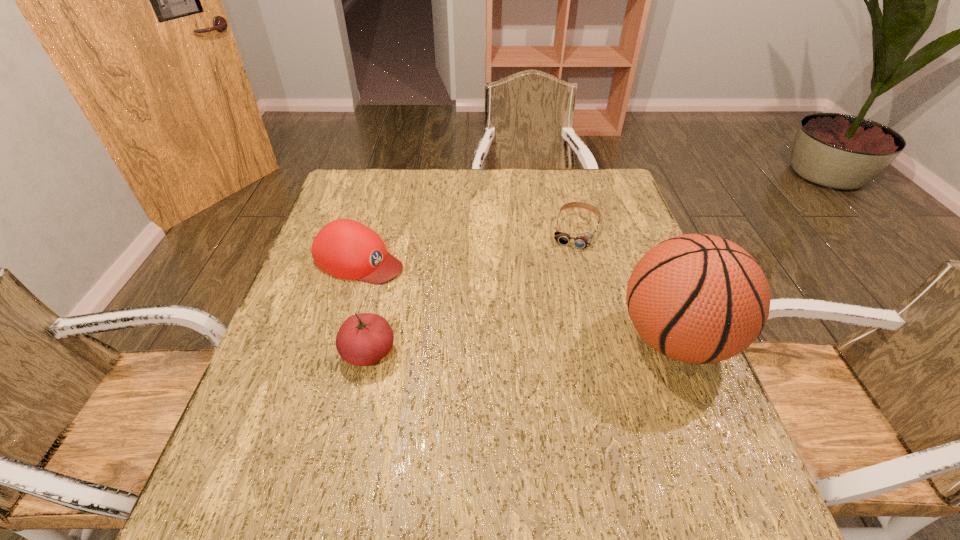
Identify the location of unoccupied area between the baseball cap and the basketball. (517, 299).

You are a GUI agent. You are given a task and a screenshot of the screen. Output one action in this format:
    pyautogui.click(x=<x>, y=<y>)
    Task: Click on the object that is the second closest to the tomato
    This screenshot has width=960, height=540.
    Given the screenshot: What is the action you would take?
    pyautogui.click(x=584, y=240)

This screenshot has width=960, height=540. What are the coordinates of `object that is the nearest to the baseball cap` in the screenshot? It's located at (363, 339).

At what (x,y) coordinates should I click in order to perform the action: click on vacant area that satisfies the following two spatial constraints: 1. on the back side of the tomato; 2. on the side where the inflation valve is located. Please return your answer as a coordinate pair (x, y). The image size is (960, 540). Looking at the image, I should click on (372, 339).

Image resolution: width=960 pixels, height=540 pixels. Identify the location of free space in the image that satisfies the following two spatial constraints: 1. on the front side of the tallest object; 2. on the side where the inflation valve is located. (603, 339).

In order to click on vacant position in the image that satisfies the following two spatial constraints: 1. on the back side of the baseball cap; 2. on the right side of the goggles in this screenshot , I will do `click(368, 231)`.

Identify the location of free region that satisfies the following two spatial constraints: 1. on the front side of the goggles; 2. on the side where the inflation valve is located. This screenshot has height=540, width=960. (603, 339).